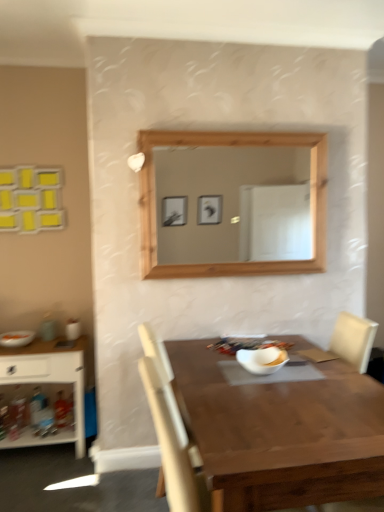
I want to click on vacant area on top of white glossy bowl at center (from a real-world perspective), so click(x=259, y=352).